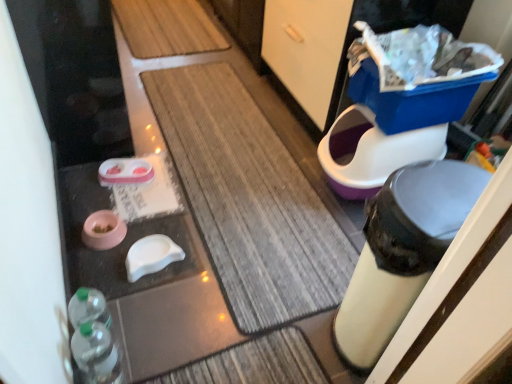
Question: Can you confirm if textured brown bath mat at center is wider than pink matte pet food bowl at lower left, which appears as the first potty when viewed from the left?

Choices:
 (A) yes
 (B) no

Answer: (A)

Question: Is textured brown bath mat at center positioned beyond the bounds of pink matte pet food bowl at lower left, the first potty from the bottom?

Choices:
 (A) yes
 (B) no

Answer: (A)

Question: Considering the relative sizes of textured brown bath mat at center and pink matte pet food bowl at lower left, which appears as the first potty when viewed from the left, in the image provided, is textured brown bath mat at center thinner than pink matte pet food bowl at lower left, which appears as the first potty when viewed from the left,?

Choices:
 (A) yes
 (B) no

Answer: (B)

Question: Can you confirm if textured brown bath mat at center is taller than pink matte pet food bowl at lower left, marked as the second potty in a right-to-left arrangement?

Choices:
 (A) no
 (B) yes

Answer: (A)

Question: Would you consider textured brown bath mat at center to be distant from pink matte pet food bowl at lower left, arranged as the second potty when viewed from the top?

Choices:
 (A) no
 (B) yes

Answer: (A)

Question: From a real-world perspective, does textured brown bath mat at center stand above pink matte pet food bowl at lower left, which appears as the first potty when viewed from the left?

Choices:
 (A) no
 (B) yes

Answer: (B)

Question: Is matte black trash can at right outside of matte white toilet bowl at right?

Choices:
 (A) yes
 (B) no

Answer: (A)

Question: From the image's perspective, would you say matte black trash can at right is shown under matte white toilet bowl at right?

Choices:
 (A) yes
 (B) no

Answer: (A)

Question: From a real-world perspective, is matte black trash can at right beneath matte white toilet bowl at right?

Choices:
 (A) no
 (B) yes

Answer: (A)

Question: Is matte black trash can at right next to matte white toilet bowl at right and touching it?

Choices:
 (A) yes
 (B) no

Answer: (B)

Question: Can you confirm if matte black trash can at right is smaller than matte white toilet bowl at right?

Choices:
 (A) no
 (B) yes

Answer: (A)

Question: Is matte black trash can at right surrounding matte white toilet bowl at right?

Choices:
 (A) yes
 (B) no

Answer: (B)

Question: Can you confirm if pink matte pet food bowl at lower left, which appears as the first potty when viewed from the left, is bigger than translucent plastic bottles at lower left?

Choices:
 (A) no
 (B) yes

Answer: (A)